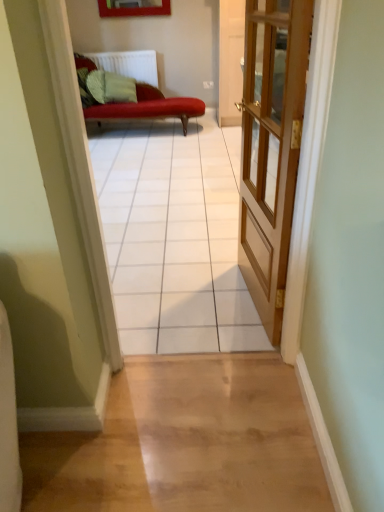
Question: In terms of height, does wooden door at center look taller or shorter compared to white tile floor at center?

Choices:
 (A) tall
 (B) short

Answer: (B)

Question: Looking at their shapes, would you say wooden door at center is wider or thinner than white tile floor at center?

Choices:
 (A) thin
 (B) wide

Answer: (A)

Question: Which of these objects is positioned farthest from the wooden door at center?

Choices:
 (A) white tile floor at center
 (B) white plastic radiator at upper center

Answer: (B)

Question: Based on their relative distances, which object is farther from the wooden door at center?

Choices:
 (A) white tile floor at center
 (B) white plastic radiator at upper center

Answer: (B)